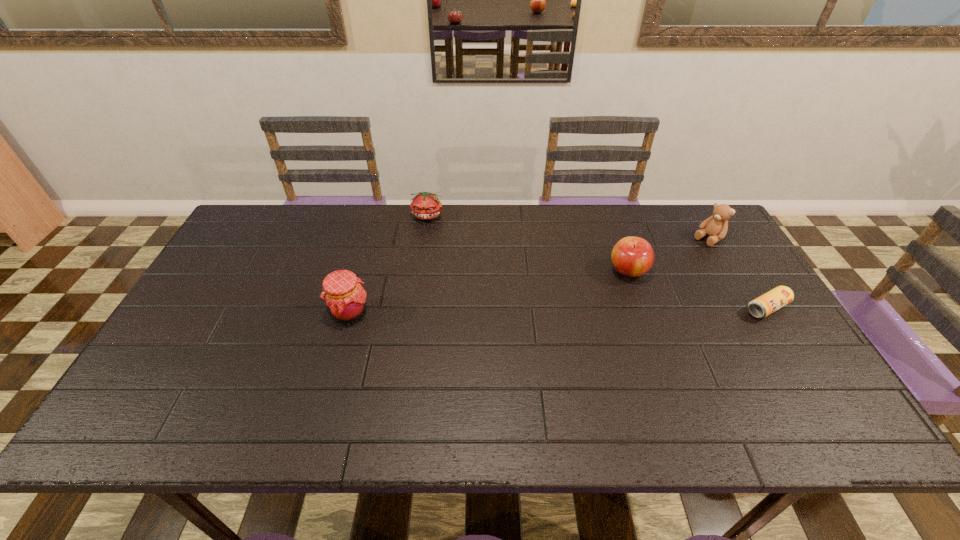
This screenshot has width=960, height=540. I want to click on free point located 0.100m on the front-facing side of the tomato, so click(446, 241).

The image size is (960, 540). Find the location of `vacant space located 0.250m on the front-facing side of the tomato`. vacant space located 0.250m on the front-facing side of the tomato is located at coordinates (467, 270).

Where is `free space located 0.130m on the stem of the third object from right to left`? Image resolution: width=960 pixels, height=540 pixels. free space located 0.130m on the stem of the third object from right to left is located at coordinates (581, 295).

Where is `free space located on the stem of the third object from right to left`? This screenshot has height=540, width=960. free space located on the stem of the third object from right to left is located at coordinates (544, 314).

Where is `vacant space situated 0.310m on the stem of the third object from right to left`? The height and width of the screenshot is (540, 960). vacant space situated 0.310m on the stem of the third object from right to left is located at coordinates (530, 322).

You are a GUI agent. You are given a task and a screenshot of the screen. Output one action in this format:
    pyautogui.click(x=<x>, y=<y>)
    Task: Click on the vacant region located 0.320m on the front-facing side of the fourth nearest object
    
    Given the screenshot: What is the action you would take?
    pyautogui.click(x=638, y=291)

Where is `blank space located on the front-facing side of the fourth nearest object`? The height and width of the screenshot is (540, 960). blank space located on the front-facing side of the fourth nearest object is located at coordinates click(x=673, y=265).

This screenshot has width=960, height=540. Identify the location of free space located on the front-facing side of the fourth nearest object. (681, 260).

I want to click on tomato that is at the far edge, so click(425, 205).

Locate an element on the screen. This screenshot has height=540, width=960. teddy bear present at the far edge is located at coordinates (716, 226).